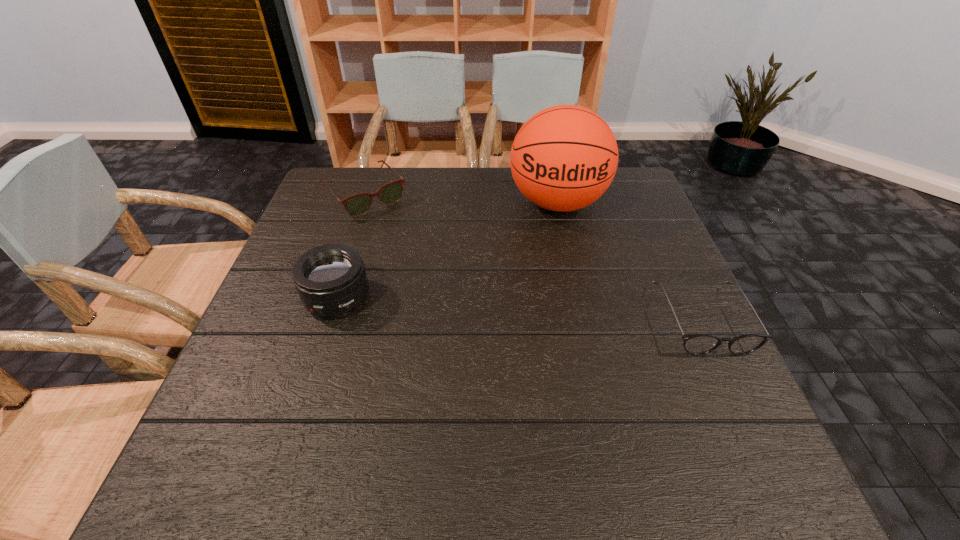
At what (x,y) coordinates should I click in order to perform the action: click on the second tallest object. Please return your answer as a coordinate pair (x, y). The width and height of the screenshot is (960, 540). Looking at the image, I should click on (331, 280).

I want to click on the nearer spectacles, so click(x=697, y=344).

Where is `the right spectacles`? the right spectacles is located at coordinates (697, 344).

This screenshot has width=960, height=540. I want to click on the left spectacles, so click(x=358, y=204).

Locate an element on the screen. The width and height of the screenshot is (960, 540). basketball is located at coordinates (563, 158).

Locate an element on the screen. The width and height of the screenshot is (960, 540). the third object from left to right is located at coordinates (563, 158).

Locate an element on the screen. This screenshot has height=540, width=960. blank space located on the side of the telephoto lens with brand markings and control switches is located at coordinates (305, 399).

You are a GUI agent. You are given a task and a screenshot of the screen. Output one action in this format:
    pyautogui.click(x=<x>, y=<y>)
    Task: Click on the blank space located 0.050m through the lenses of the nearer spectacles
    
    Given the screenshot: What is the action you would take?
    pyautogui.click(x=729, y=377)

Find the location of `vacant space situated 0.080m at the front view of the farther spectacles`. vacant space situated 0.080m at the front view of the farther spectacles is located at coordinates (398, 231).

The height and width of the screenshot is (540, 960). I want to click on vacant space located at the front view of the farther spectacles, so click(x=424, y=259).